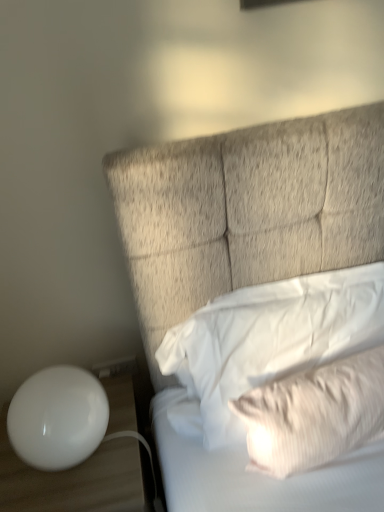
Identify the location of empty space that is ontop of white glossy sphere at lower left. (51, 384).